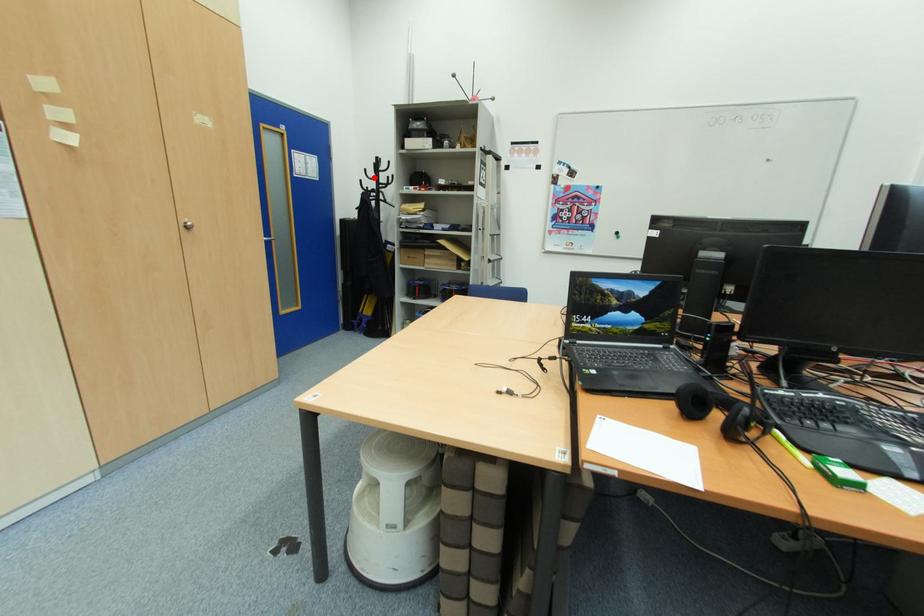
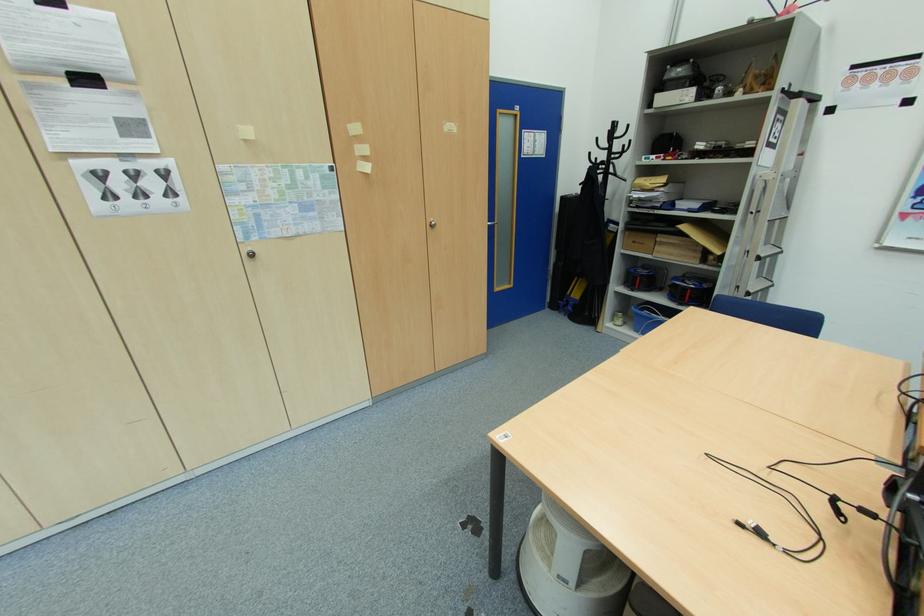
The point at the highlighted location is marked in the first image. Where is the corresponding point in the second image?

(605, 147)